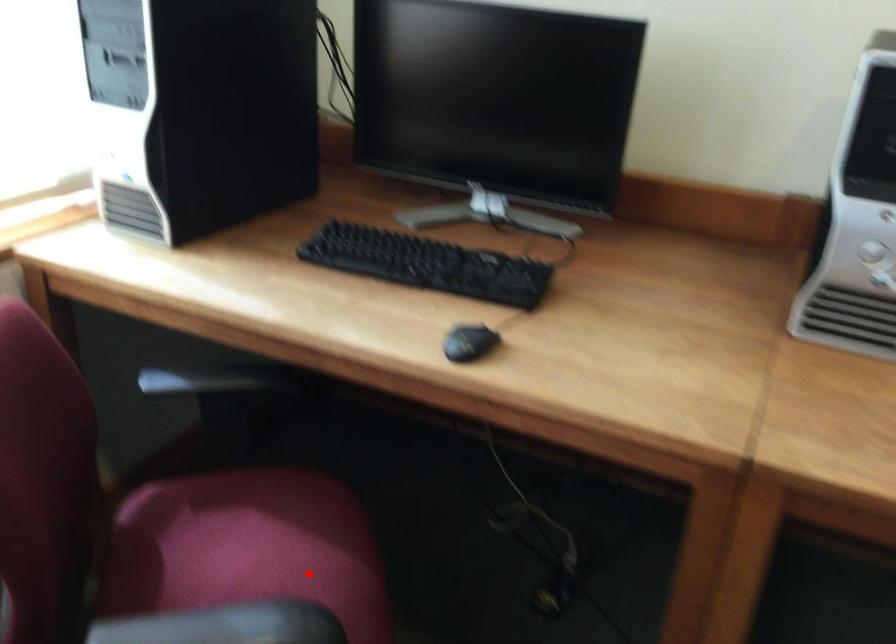
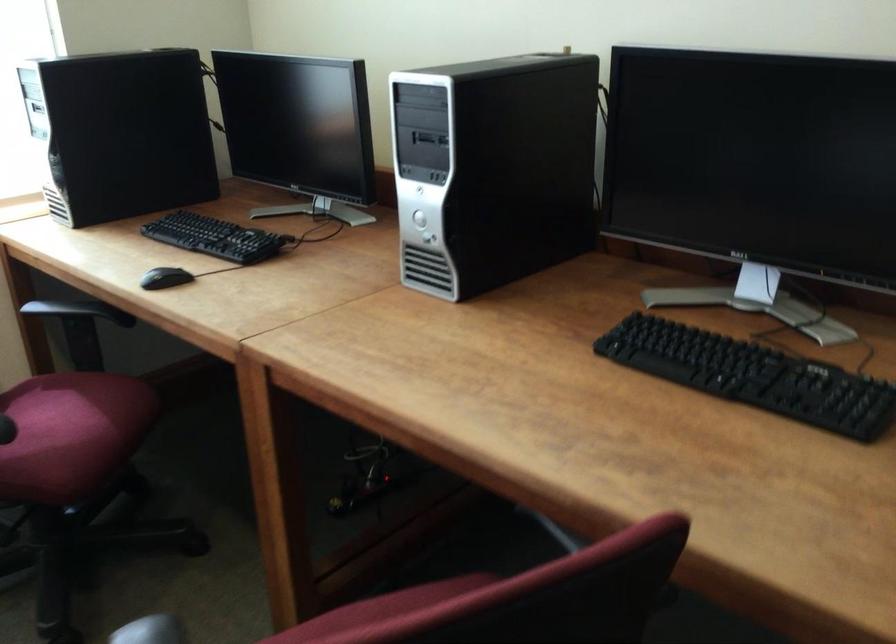
Question: I am providing you with two images of the same scene from different viewpoints. In image1, a red point is highlighted. Considering the same 3D point in image2, which of the following is correct?

Choices:
 (A) It is closer
 (B) It is farther

Answer: (B)